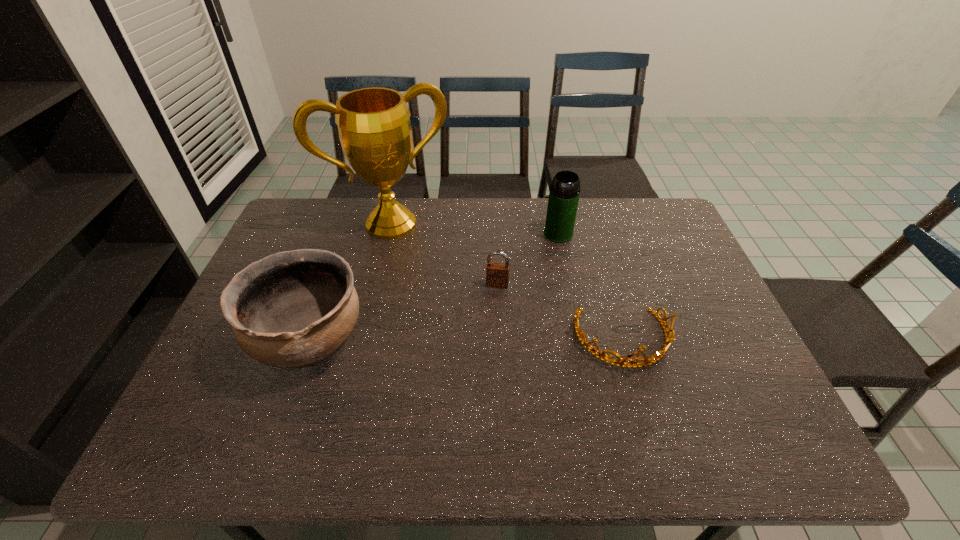
The width and height of the screenshot is (960, 540). What are the coordinates of `vacant spot on the desktop that is between the third tallest object and the shortest object and is positioned from the spout of the fourth shortest object` in the screenshot? It's located at (501, 340).

Where is `free space on the desktop that is between the third shortest object and the tiara and is positioned on the front-facing side of the award`? The width and height of the screenshot is (960, 540). free space on the desktop that is between the third shortest object and the tiara and is positioned on the front-facing side of the award is located at coordinates (444, 340).

You are a GUI agent. You are given a task and a screenshot of the screen. Output one action in this format:
    pyautogui.click(x=<x>, y=<y>)
    Task: Click on the free space on the desktop that is between the third tallest object and the tiara and is positioned on the front-facing side of the second shortest object
    This screenshot has width=960, height=540.
    Given the screenshot: What is the action you would take?
    pyautogui.click(x=487, y=340)